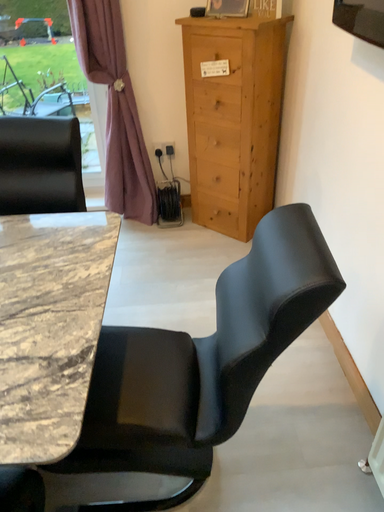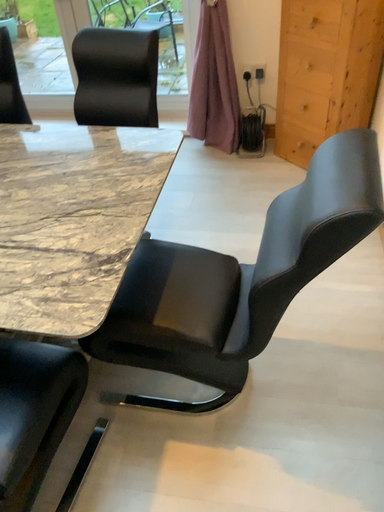
Question: Which way did the camera rotate in the video?

Choices:
 (A) rotated right
 (B) rotated left

Answer: (B)